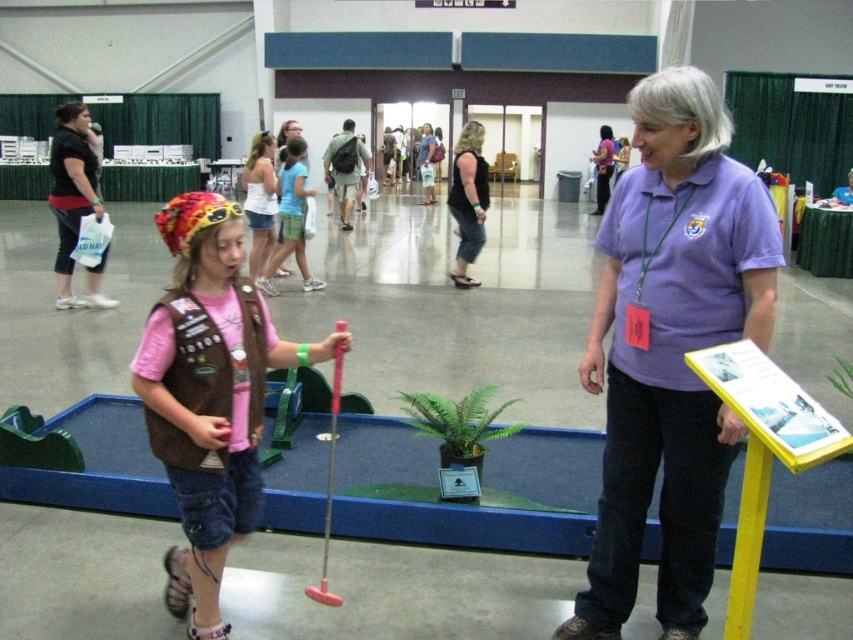
Question: Does matte black shirt at left appear on the right side of purple shirt at center?

Choices:
 (A) yes
 (B) no

Answer: (B)

Question: Among these objects, which one is farthest from the camera?

Choices:
 (A) white cotton tank top at center
 (B) pink fabric vest at left
 (C) black fabric pants at center
 (D) purple shirt at center

Answer: (D)

Question: Which of the following is the closest to the observer?

Choices:
 (A) white cotton tank top at center
 (B) purple cotton shirt at center

Answer: (B)

Question: Does purple cotton shirt at center have a greater width compared to white cotton tank top at center?

Choices:
 (A) yes
 (B) no

Answer: (A)

Question: Which point is closer to the camera?

Choices:
 (A) [457, 256]
 (B) [274, 240]

Answer: (B)

Question: Is purple cotton shirt at center bigger than white cotton tank top at center?

Choices:
 (A) no
 (B) yes

Answer: (B)